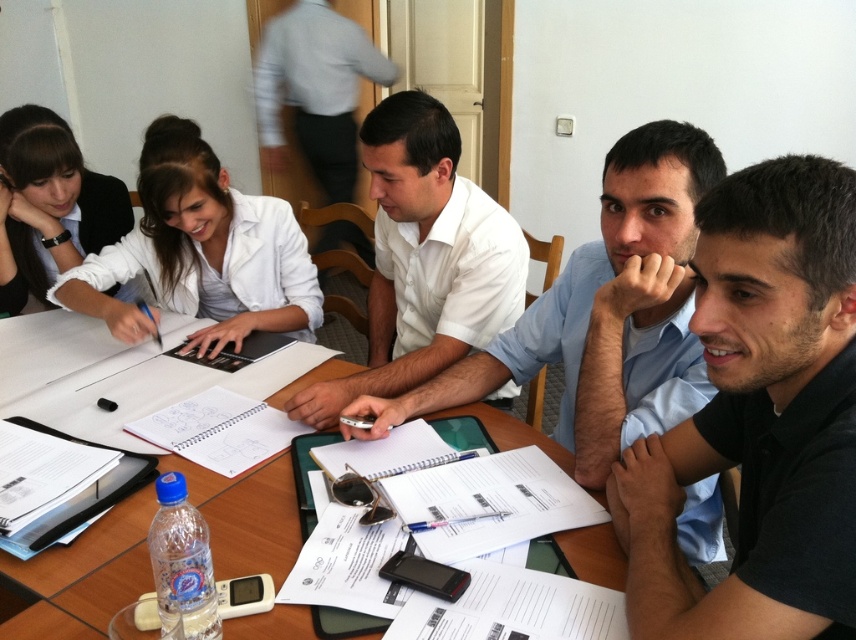
You are standing at the origin point of the coordinate system where the table is centered. You need to locate the black matte shirt at center. What are its coordinates?

The coordinates of the black matte shirt at center are at point (759, 417).

Consider the image. You are sitting at the wooden table at center and want to reach the black matte shirt at center. Is the shirt to your left or right side?

The black matte shirt at center is positioned on the right side of wooden table at center, so it would be to your right side.